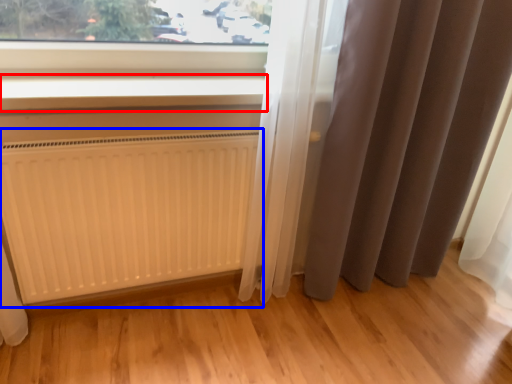
Question: Which of the following is the closest to the observer, window sill (highlighted by a red box) or radiator (highlighted by a blue box)?

Choices:
 (A) window sill
 (B) radiator

Answer: (A)